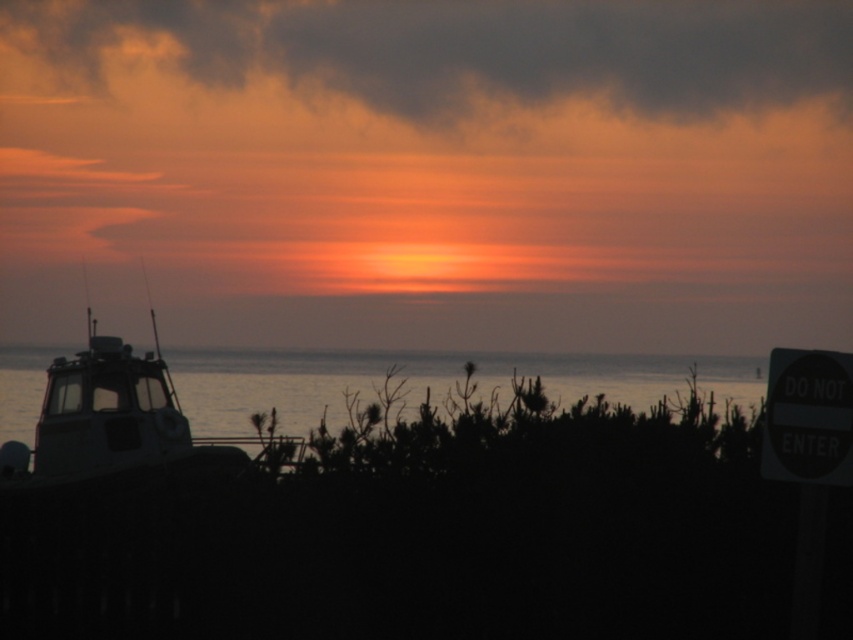
Looking at this image, is cloudy sky at upper center further to camera compared to smooth water at lower left?

That is True.

Which of these two, cloudy sky at upper center or smooth water at lower left, stands shorter?

smooth water at lower left

Locate an element on the screen. cloudy sky at upper center is located at coordinates (477, 49).

Can you confirm if smooth water at lower left is positioned to the left of silhouette metal boat at left?

No, smooth water at lower left is not to the left of silhouette metal boat at left.

Is point (741, 397) positioned before point (44, 419)?

No, (741, 397) is behind (44, 419).

What do you see at coordinates (431, 381) in the screenshot? I see `smooth water at lower left` at bounding box center [431, 381].

This screenshot has width=853, height=640. Identify the location of smooth water at lower left. (431, 381).

Who is positioned more to the left, cloudy sky at upper center or silhouette metal boat at left?

From the viewer's perspective, silhouette metal boat at left appears more on the left side.

Looking at this image, is cloudy sky at upper center thinner than silhouette metal boat at left?

No, cloudy sky at upper center is not thinner than silhouette metal boat at left.

Which is in front, point (834, 3) or point (155, 477)?

Point (155, 477)

This screenshot has height=640, width=853. Identify the location of cloudy sky at upper center. (477, 49).